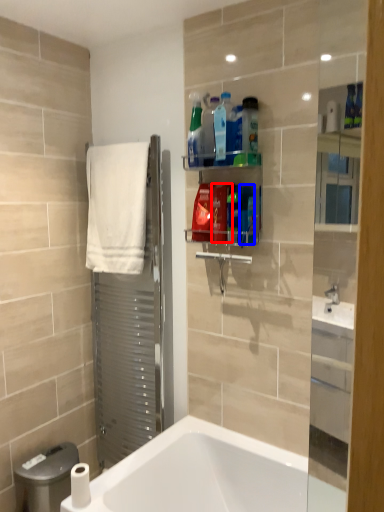
Question: Which object is closer to the camera taking this photo, cleaning product (highlighted by a red box) or cleaning product (highlighted by a blue box)?

Choices:
 (A) cleaning product
 (B) cleaning product

Answer: (B)